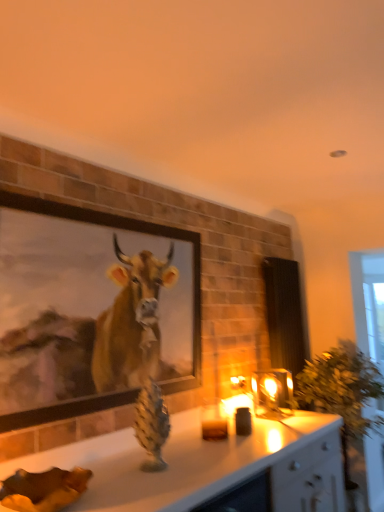
Question: Would you say green leafy plant at right is a long distance from wooden framed painting at upper left?

Choices:
 (A) no
 (B) yes

Answer: (B)

Question: Does green leafy plant at right have a greater width compared to wooden framed painting at upper left?

Choices:
 (A) yes
 (B) no

Answer: (A)

Question: Is green leafy plant at right smaller than wooden framed painting at upper left?

Choices:
 (A) yes
 (B) no

Answer: (B)

Question: Considering the relative positions of green leafy plant at right and wooden framed painting at upper left in the image provided, is green leafy plant at right in front of wooden framed painting at upper left?

Choices:
 (A) yes
 (B) no

Answer: (B)

Question: Can you confirm if green leafy plant at right is taller than wooden framed painting at upper left?

Choices:
 (A) no
 (B) yes

Answer: (B)

Question: Does green leafy plant at right appear on the right side of wooden framed painting at upper left?

Choices:
 (A) no
 (B) yes

Answer: (B)

Question: Is the position of translucent glass candle at center less distant than that of wooden framed painting at upper left?

Choices:
 (A) yes
 (B) no

Answer: (B)

Question: Considering the relative sizes of translucent glass candle at center and wooden framed painting at upper left in the image provided, is translucent glass candle at center bigger than wooden framed painting at upper left?

Choices:
 (A) yes
 (B) no

Answer: (B)

Question: From a real-world perspective, is translucent glass candle at center on wooden framed painting at upper left?

Choices:
 (A) yes
 (B) no

Answer: (B)

Question: Considering the relative positions of translucent glass candle at center and wooden framed painting at upper left in the image provided, is translucent glass candle at center to the right of wooden framed painting at upper left from the viewer's perspective?

Choices:
 (A) yes
 (B) no

Answer: (A)

Question: Can you confirm if translucent glass candle at center is smaller than wooden framed painting at upper left?

Choices:
 (A) yes
 (B) no

Answer: (A)

Question: Are translucent glass candle at center and wooden framed painting at upper left making contact?

Choices:
 (A) no
 (B) yes

Answer: (A)

Question: Can you confirm if wooden framed painting at upper left is bigger than green leafy plant at right?

Choices:
 (A) no
 (B) yes

Answer: (A)